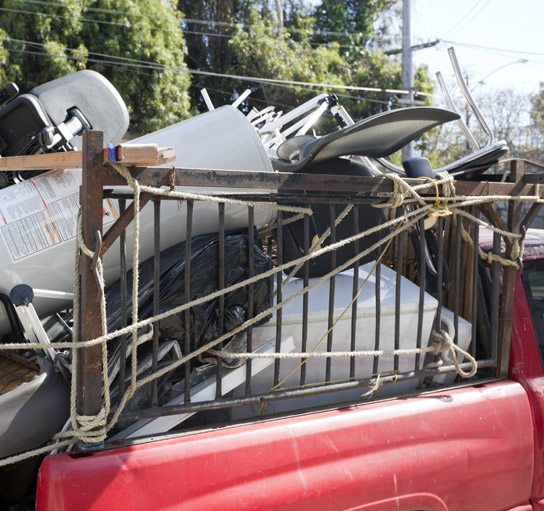
Identify the location of window. (528, 278).